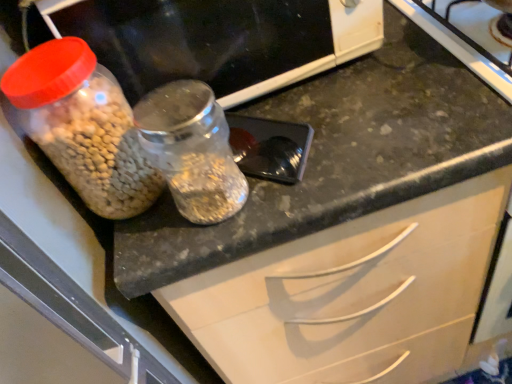
Question: Considering the positions of transparent glass jar at center and translucent plastic jar at left in the image, is transparent glass jar at center wider or thinner than translucent plastic jar at left?

Choices:
 (A) wide
 (B) thin

Answer: (B)

Question: Considering the positions of point (203, 89) and point (161, 79), is point (203, 89) closer or farther from the camera than point (161, 79)?

Choices:
 (A) farther
 (B) closer

Answer: (B)

Question: Estimate the real-world distances between objects in this image. Which object is farther from the translucent plastic jar at left?

Choices:
 (A) metallic black spoon at center
 (B) translucent plastic jar at left
 (C) transparent glass jar at center

Answer: (B)

Question: Which object is the farthest from the metallic black spoon at center?

Choices:
 (A) translucent plastic jar at left
 (B) transparent glass jar at center
 (C) translucent plastic jar at left

Answer: (A)